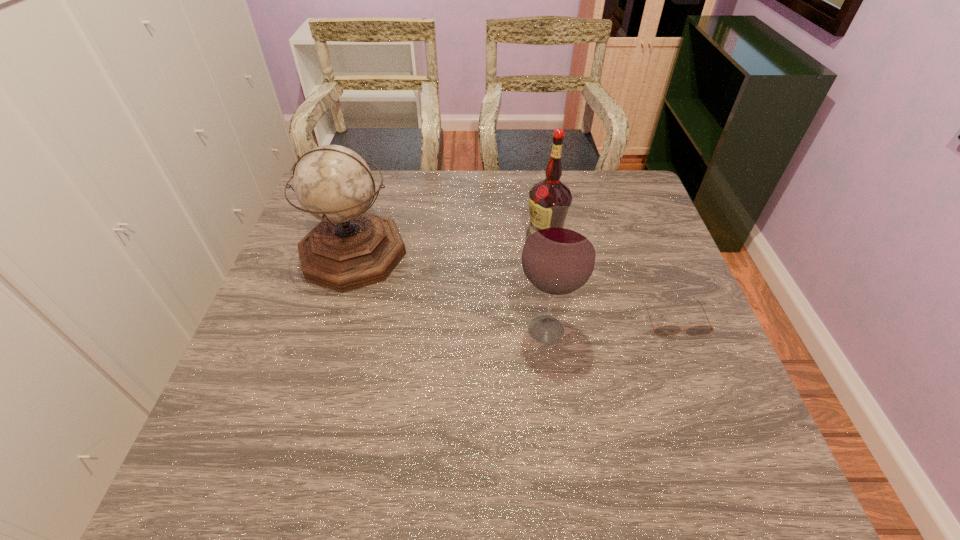
This screenshot has height=540, width=960. In order to click on blank space that satisfies the following two spatial constraints: 1. on the label of the farther alcohol; 2. on the surface of the globe in this screenshot , I will do `click(547, 253)`.

This screenshot has height=540, width=960. Find the location of `free location that satisfies the following two spatial constraints: 1. on the surface of the nearer alcohol; 2. on the right side of the leftmost object`. free location that satisfies the following two spatial constraints: 1. on the surface of the nearer alcohol; 2. on the right side of the leftmost object is located at coordinates click(x=331, y=329).

Find the location of a particular element. free space that satisfies the following two spatial constraints: 1. on the surface of the nearer alcohol; 2. on the left side of the leftmost object is located at coordinates (x=331, y=329).

This screenshot has height=540, width=960. Identify the location of free spot that satisfies the following two spatial constraints: 1. on the surface of the nearer alcohol; 2. on the right side of the leftmost object. (331, 329).